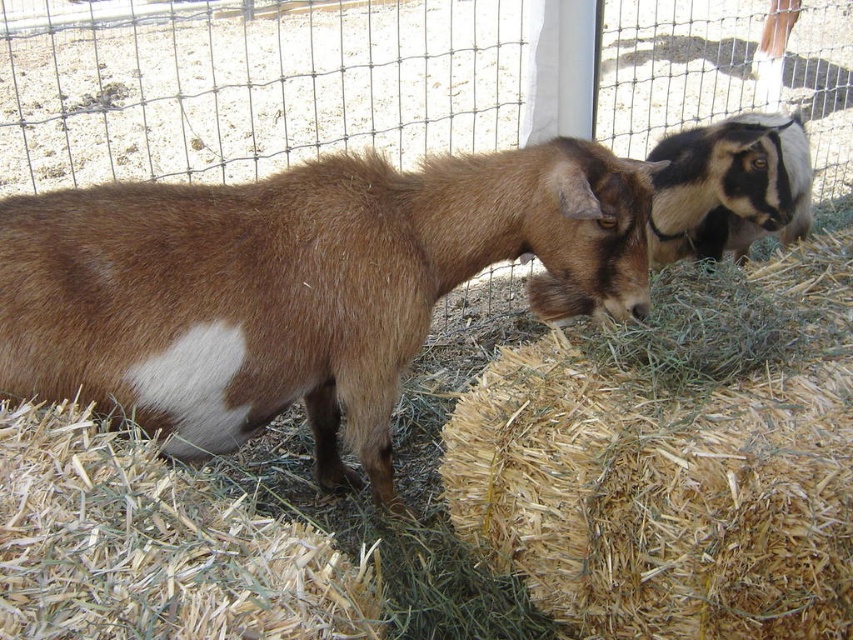
You are standing in front of the enclosure at the farm. There is a point marked at coordinates (292, 285). What animal is located at that point?

The brown fuzzy goat at center is located at point (292, 285).

You are standing in front of the enclosure with two goats. There are two points marked in the image. One is at coordinate point (223, 445) and the other at point (769, 129). Which point is nearer to you?

Point (223, 445) is closer to the camera than point (769, 129).